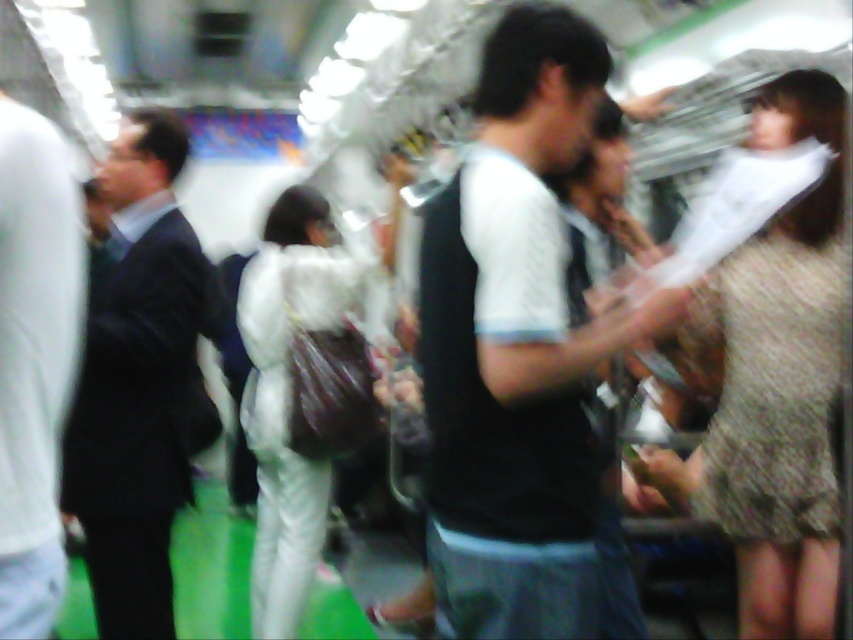
Does dark suit at left come behind dark gray suit at left?

Yes, dark suit at left is further from the viewer.

You are a GUI agent. You are given a task and a screenshot of the screen. Output one action in this format:
    pyautogui.click(x=<x>, y=<y>)
    Task: Click on the dark suit at left
    
    Given the screenshot: What is the action you would take?
    pyautogui.click(x=138, y=381)

Where is `dark suit at left`? Image resolution: width=853 pixels, height=640 pixels. dark suit at left is located at coordinates (138, 381).

Identify the location of dark suit at left. (138, 381).

Can you confirm if dark suit at left is positioned to the right of white matte suit at center?

No, dark suit at left is not to the right of white matte suit at center.

Is point (151, 333) farther from viewer compared to point (299, 566)?

No, it is in front of (299, 566).

Image resolution: width=853 pixels, height=640 pixels. In order to click on dark suit at left in this screenshot , I will do `click(138, 381)`.

This screenshot has width=853, height=640. Find the location of `black matte vest at center`. black matte vest at center is located at coordinates point(515,348).

The height and width of the screenshot is (640, 853). I want to click on black matte vest at center, so click(x=515, y=348).